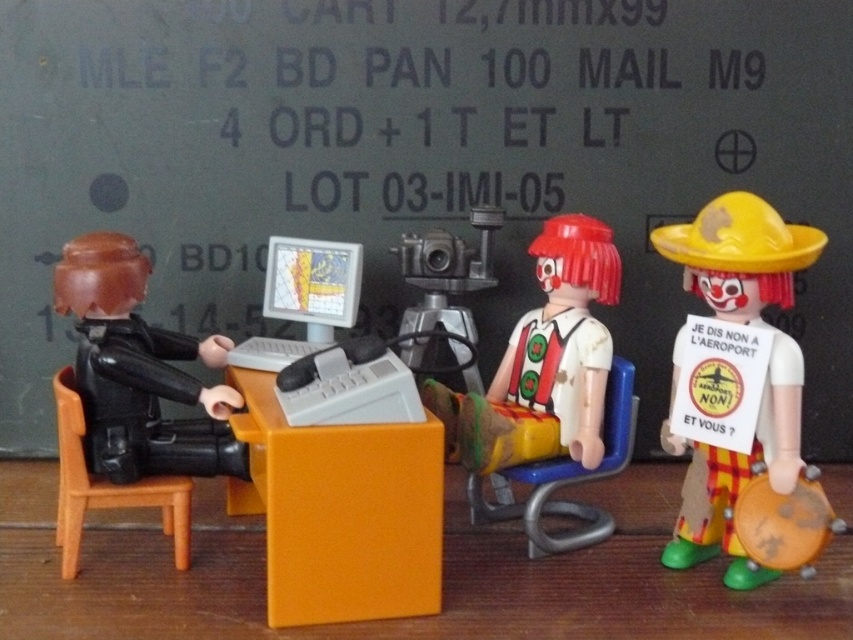
Does yellow matte clown at right appear under white plastic clown at center?

Yes, yellow matte clown at right is below white plastic clown at center.

Between yellow matte clown at right and white plastic clown at center, which one has less height?

white plastic clown at center

Does point (701, 552) come behind point (554, 356)?

That is False.

The image size is (853, 640). I want to click on yellow matte clown at right, so click(740, 256).

Between white plastic clown at center and blue plastic chair at center, which one has less height?

With less height is blue plastic chair at center.

How much distance is there between white plastic clown at center and blue plastic chair at center?

white plastic clown at center is 3.02 inches away from blue plastic chair at center.

Between point (552, 356) and point (630, 378), which one is positioned in front?

Point (630, 378) is more forward.

Image resolution: width=853 pixels, height=640 pixels. What are the coordinates of `white plastic clown at center` in the screenshot? It's located at (544, 362).

Which is more to the left, matte black figure at left or orange plastic chair at left?

orange plastic chair at left is more to the left.

Can you confirm if matte black figure at left is smaller than orange plastic chair at left?

Incorrect, matte black figure at left is not smaller in size than orange plastic chair at left.

Identify the location of matte black figure at left. The image size is (853, 640). (138, 371).